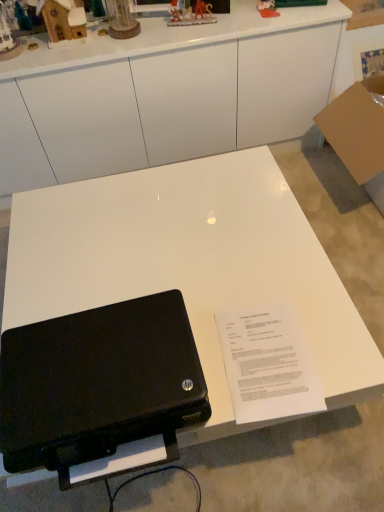
Locate an element on the screen. This screenshot has width=384, height=512. vacant area on the back side of metallic silver sleigh at upper center, placed as the second toy when sorted from right to left is located at coordinates (191, 13).